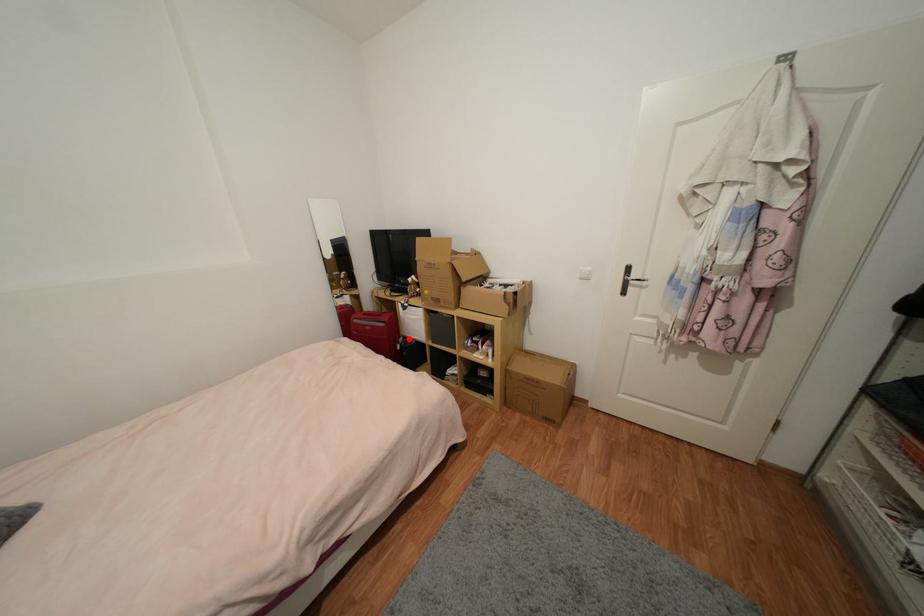
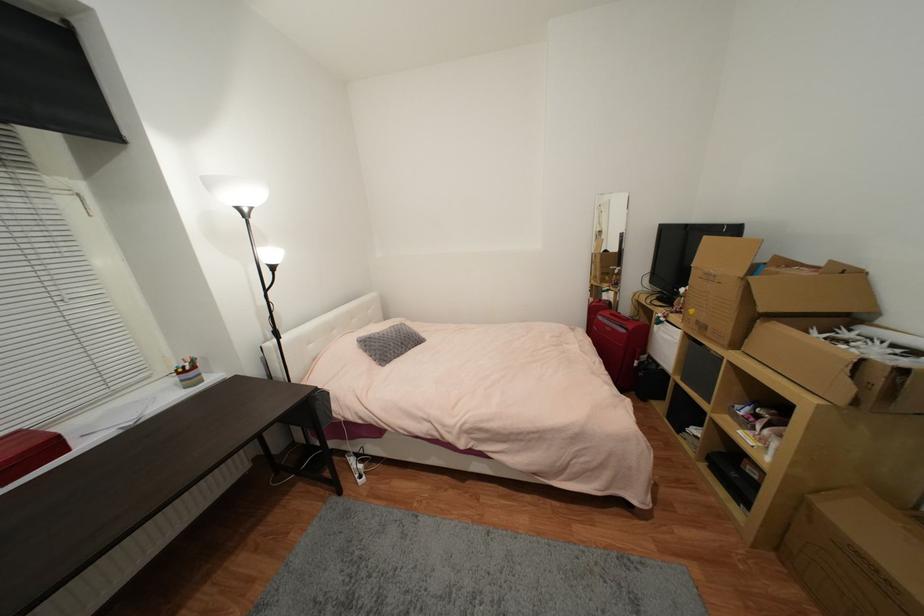
Question: I am providing you with two images of the same scene from different viewpoints. Given a red point in image1, look at the same physical point in image2. Is it:

Choices:
 (A) Closer to the viewpoint
 (B) Farther from the viewpoint

Answer: (A)